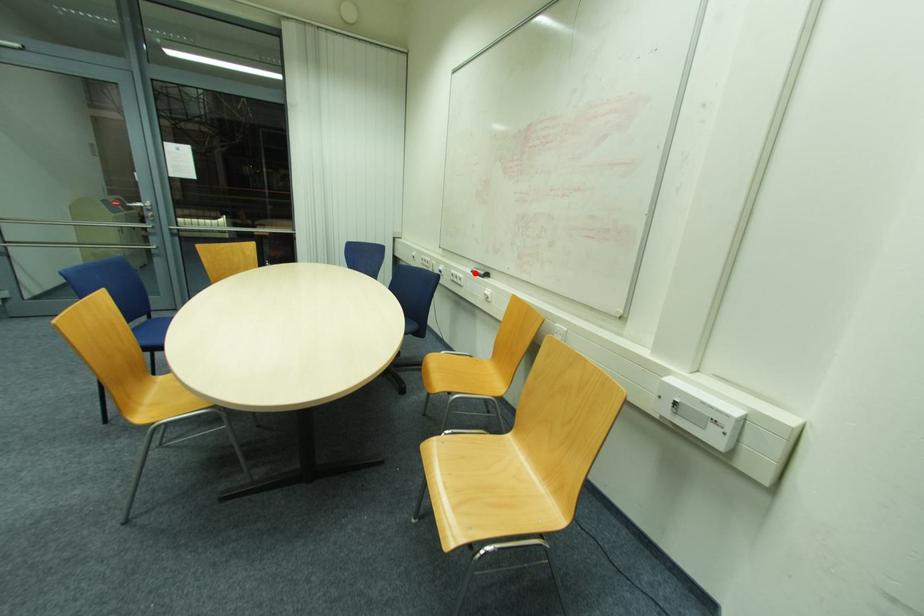
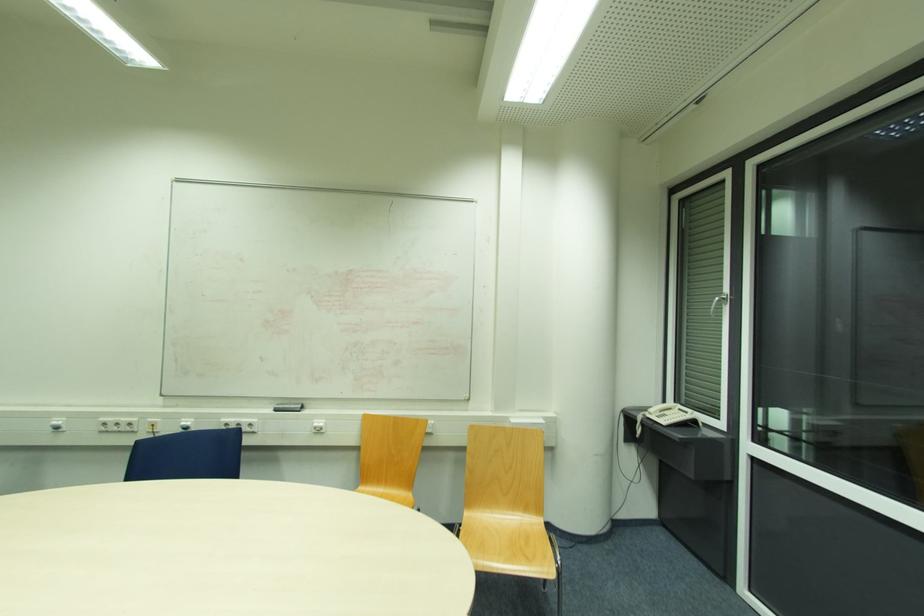
Find the pixel in the second image that matches the highlighted location in the first image.

(276, 411)